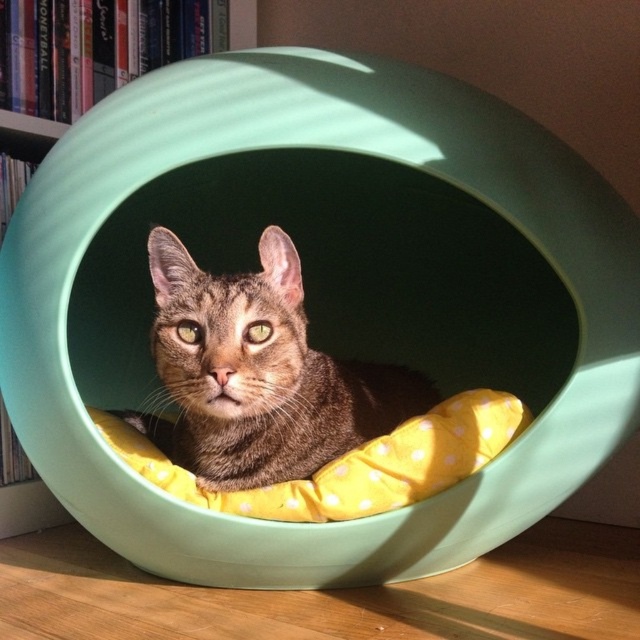
Question: Does brown fur cat at center have a larger size compared to matte plastic bookshelf at upper left?

Choices:
 (A) no
 (B) yes

Answer: (B)

Question: Which object appears farthest from the camera in this image?

Choices:
 (A) brown fur cat at center
 (B) matte plastic bookshelf at upper left

Answer: (B)

Question: Can you confirm if brown fur cat at center is wider than matte plastic bookshelf at upper left?

Choices:
 (A) yes
 (B) no

Answer: (A)

Question: Can you confirm if brown fur cat at center is smaller than matte plastic bookshelf at upper left?

Choices:
 (A) yes
 (B) no

Answer: (B)

Question: Which point is farther to the camera?

Choices:
 (A) brown fur cat at center
 (B) matte plastic bookshelf at upper left

Answer: (B)